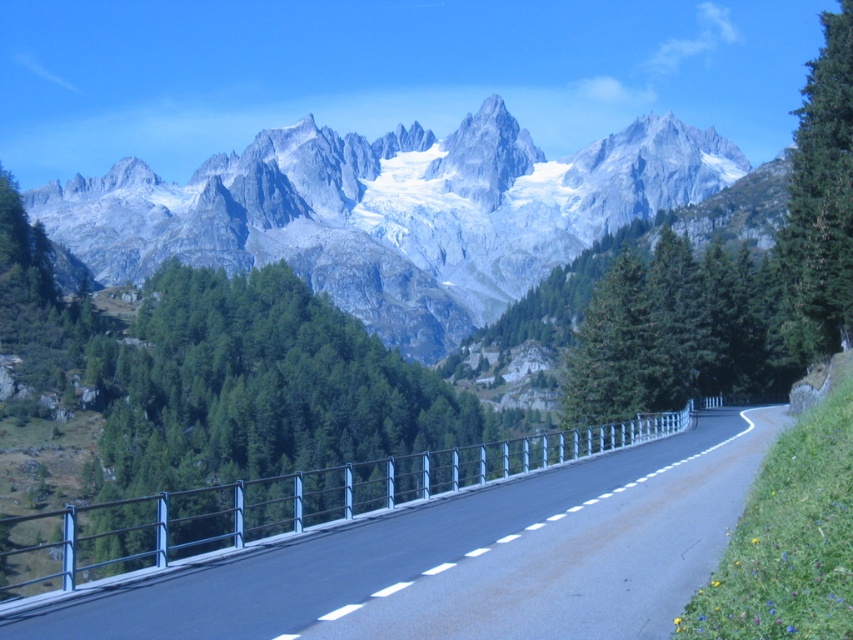
Question: Based on their relative distances, which object is farther from the green matte tree at right?

Choices:
 (A) green leafy trees at center
 (B) gray rocky mountain range at upper center

Answer: (B)

Question: Does black asphalt road at center appear on the left side of green matte tree at right?

Choices:
 (A) no
 (B) yes

Answer: (B)

Question: Is black asphalt road at center wider than green leafy trees at center?

Choices:
 (A) yes
 (B) no

Answer: (B)

Question: Which object is farther from the camera taking this photo?

Choices:
 (A) green leafy trees at center
 (B) black asphalt road at center
 (C) gray rocky mountain range at upper center

Answer: (C)

Question: Estimate the real-world distances between objects in this image. Which object is farther from the black asphalt road at center?

Choices:
 (A) green matte tree at right
 (B) green leafy trees at center
 (C) gray rocky mountain range at upper center

Answer: (C)

Question: Where is gray rocky mountain range at upper center located in relation to black asphalt road at center in the image?

Choices:
 (A) below
 (B) above

Answer: (B)